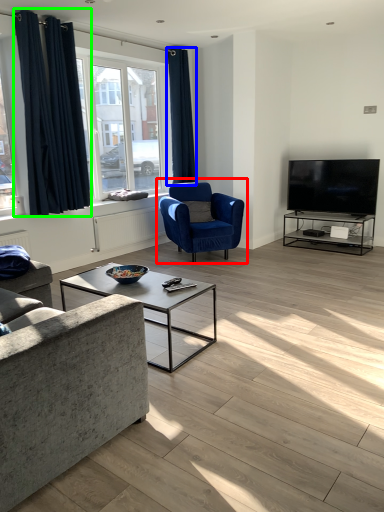
Question: Which object is positioned farthest from chair (highlighted by a red box)? Select from curtain (highlighted by a blue box) and curtain (highlighted by a green box).

Choices:
 (A) curtain
 (B) curtain

Answer: (B)